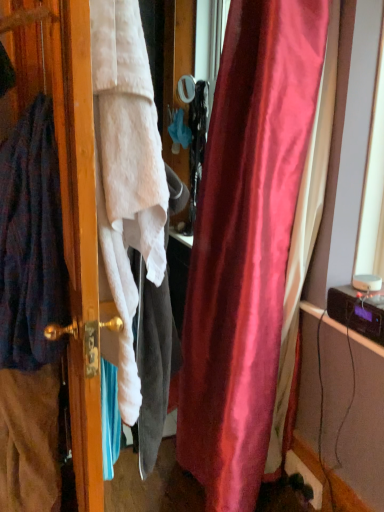
Question: Considering the relative sizes of white fabric screen door at left and dark blue woolen cardigan at left in the image provided, is white fabric screen door at left smaller than dark blue woolen cardigan at left?

Choices:
 (A) no
 (B) yes

Answer: (A)

Question: Considering the relative sizes of white fabric screen door at left and dark blue woolen cardigan at left in the image provided, is white fabric screen door at left shorter than dark blue woolen cardigan at left?

Choices:
 (A) no
 (B) yes

Answer: (A)

Question: Does white fabric screen door at left appear on the left side of dark blue woolen cardigan at left?

Choices:
 (A) yes
 (B) no

Answer: (B)

Question: Considering the relative positions of white fabric screen door at left and dark blue woolen cardigan at left in the image provided, is white fabric screen door at left to the right of dark blue woolen cardigan at left from the viewer's perspective?

Choices:
 (A) no
 (B) yes

Answer: (B)

Question: Would you say white fabric screen door at left is a long distance from dark blue woolen cardigan at left?

Choices:
 (A) no
 (B) yes

Answer: (A)

Question: From the image's perspective, would you say white fabric screen door at left is shown under dark blue woolen cardigan at left?

Choices:
 (A) yes
 (B) no

Answer: (A)

Question: Does dark blue woolen cardigan at left appear on the left side of white fabric screen door at left?

Choices:
 (A) yes
 (B) no

Answer: (A)

Question: From a real-world perspective, is dark blue woolen cardigan at left physically below white fabric screen door at left?

Choices:
 (A) no
 (B) yes

Answer: (A)

Question: From a real-world perspective, is dark blue woolen cardigan at left physically above white fabric screen door at left?

Choices:
 (A) no
 (B) yes

Answer: (B)

Question: Is dark blue woolen cardigan at left in front of white fabric screen door at left?

Choices:
 (A) yes
 (B) no

Answer: (B)

Question: Does dark blue woolen cardigan at left have a smaller size compared to white fabric screen door at left?

Choices:
 (A) yes
 (B) no

Answer: (A)

Question: Can you confirm if dark blue woolen cardigan at left is shorter than white fabric screen door at left?

Choices:
 (A) yes
 (B) no

Answer: (A)

Question: Considering the positions of white fabric screen door at left and dark blue woolen cardigan at left in the image, is white fabric screen door at left wider or thinner than dark blue woolen cardigan at left?

Choices:
 (A) wide
 (B) thin

Answer: (A)